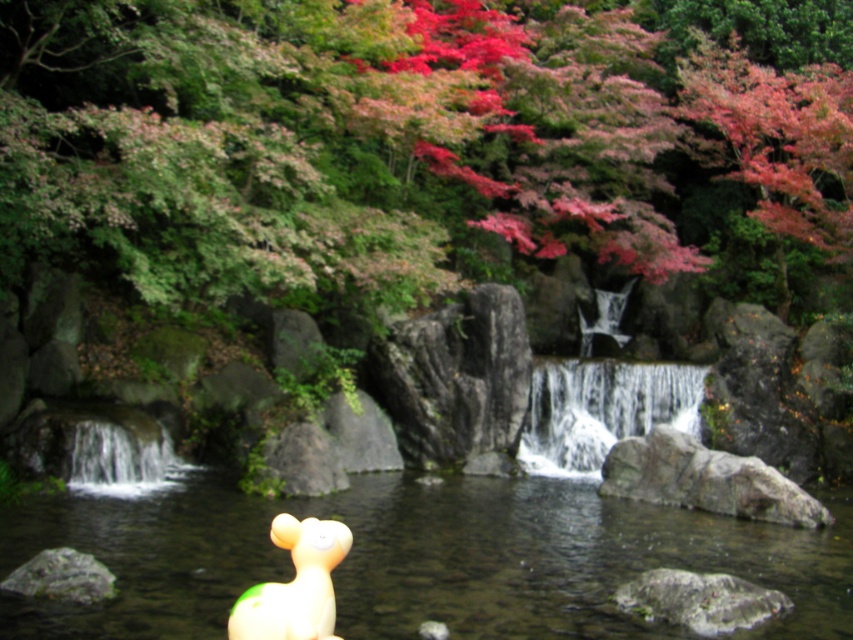
In the scene shown: Can you confirm if green matte tree at upper center is thinner than white frothy water at center?

No.

Who is more distant from viewer, (322, 120) or (625, 432)?

Point (625, 432)

Who is more distant from viewer, (289, 3) or (573, 365)?

The point (573, 365) is behind.

Where is `green matte tree at upper center`? green matte tree at upper center is located at coordinates (416, 140).

Does white frothy water at center appear under gray rough rock at lower right?

No, white frothy water at center is not below gray rough rock at lower right.

This screenshot has width=853, height=640. Describe the element at coordinates (601, 410) in the screenshot. I see `white frothy water at center` at that location.

Image resolution: width=853 pixels, height=640 pixels. I want to click on white frothy water at center, so click(x=601, y=410).

Is white frothy water at center positioned before white frothy water at lower left?

No, white frothy water at center is further to the viewer.

Between point (547, 458) and point (146, 484), which one is positioned in front?

Point (146, 484) is in front.

Does point (570, 362) come in front of point (106, 426)?

No, it is not.

The image size is (853, 640). I want to click on white frothy water at center, so click(x=601, y=410).